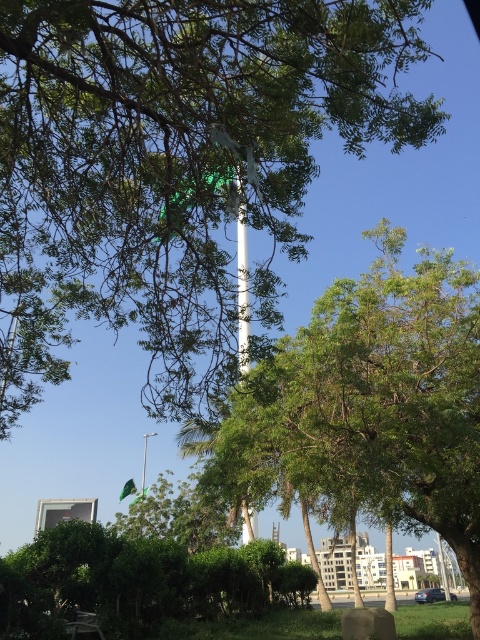
The width and height of the screenshot is (480, 640). Describe the element at coordinates (175, 164) in the screenshot. I see `green leafy tree at upper center` at that location.

At what (x,y) coordinates should I click in order to perform the action: click on green leafy tree at upper center. Please return your answer as a coordinate pair (x, y). Looking at the image, I should click on (175, 164).

Looking at this image, does white glossy pole at center have a greater width compared to green fabric flag at center?

No, white glossy pole at center is not wider than green fabric flag at center.

Does white glossy pole at center have a lesser height compared to green fabric flag at center?

No.

Between point (247, 285) and point (145, 460), which one is positioned behind?

The point (145, 460) is more distant.

Identify the location of white glossy pole at center. (242, 292).

Can you confirm if green leafy tree at upper center is positioned to the right of green fabric flag at center?

Yes, green leafy tree at upper center is to the right of green fabric flag at center.

Does green leafy tree at upper center have a lesser height compared to green fabric flag at center?

In fact, green leafy tree at upper center may be taller than green fabric flag at center.

Does point (8, 248) lie behind point (141, 493)?

No, (8, 248) is closer to viewer.

Locate an element on the screen. This screenshot has width=480, height=640. green leafy tree at upper center is located at coordinates (175, 164).